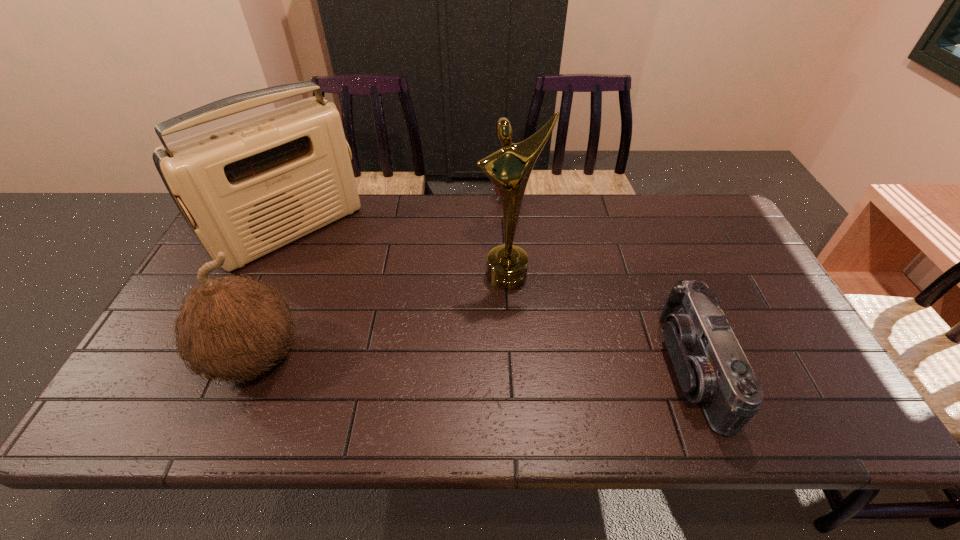
Where is `coconut`? The image size is (960, 540). coconut is located at coordinates (232, 327).

Where is `camcorder`? camcorder is located at coordinates (712, 369).

Find the location of a particular element. This screenshot has width=960, height=540. award is located at coordinates (509, 168).

What are the coordinates of `alarm clock` in the screenshot? It's located at (495, 188).

Where is `radio receiver`? The image size is (960, 540). radio receiver is located at coordinates (248, 188).

The width and height of the screenshot is (960, 540). What are the coordinates of `vacant area located on the front-facing side of the camcorder` in the screenshot? It's located at (539, 369).

Locate an element on the screen. Image resolution: width=960 pixels, height=540 pixels. vacant area situated on the front-facing side of the camcorder is located at coordinates (539, 369).

This screenshot has height=540, width=960. In order to click on free space located on the front-facing side of the camcorder in this screenshot , I will do coord(564,369).

Locate an element on the screen. vacant space located 0.210m on the front-facing side of the award is located at coordinates (530, 354).

I want to click on free space located on the front-facing side of the award, so click(537, 382).